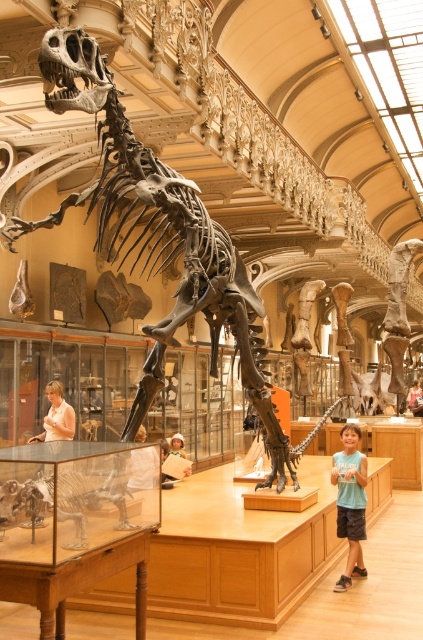
Between shiny metallic dinosaur at center and light blue t-shirt at lower right, which one appears on the right side from the viewer's perspective?

light blue t-shirt at lower right

Is shiny metallic dinosaur at center below light blue t-shirt at lower right?

Actually, shiny metallic dinosaur at center is above light blue t-shirt at lower right.

Is point (43, 472) farther from viewer compared to point (359, 435)?

That is False.

Locate an element on the screen. shiny metallic dinosaur at center is located at coordinates (69, 506).